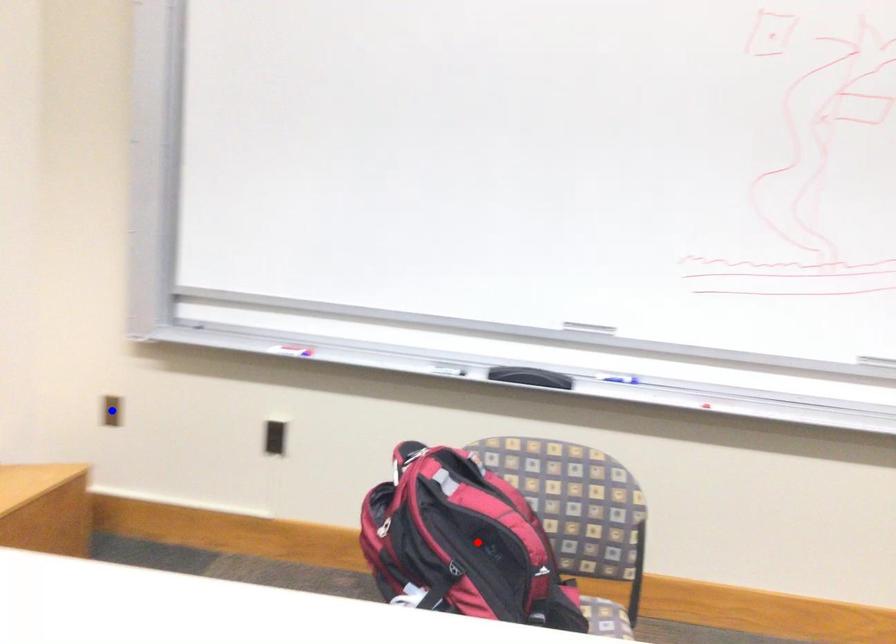
Question: Which of the two points in the image is closer to the camera?

Choices:
 (A) Blue point is closer.
 (B) Red point is closer.

Answer: (B)